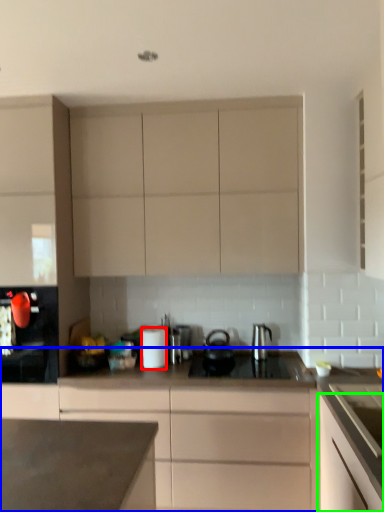
Question: Considering the real-world distances, which object is farthest from kitchen appliance (highlighted by a red box)? cabinetry (highlighted by a blue box) or cabinetry (highlighted by a green box)?

Choices:
 (A) cabinetry
 (B) cabinetry

Answer: (B)